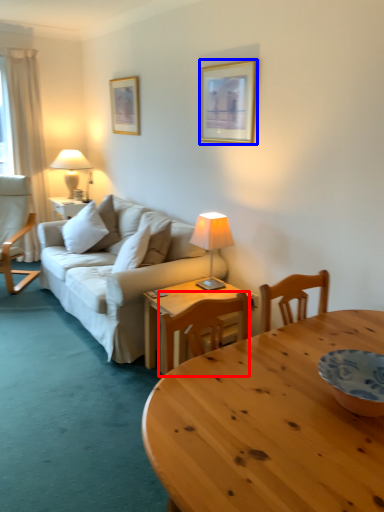
Question: Which point is further to the camera, chair (highlighted by a red box) or picture frame (highlighted by a blue box)?

Choices:
 (A) chair
 (B) picture frame

Answer: (B)